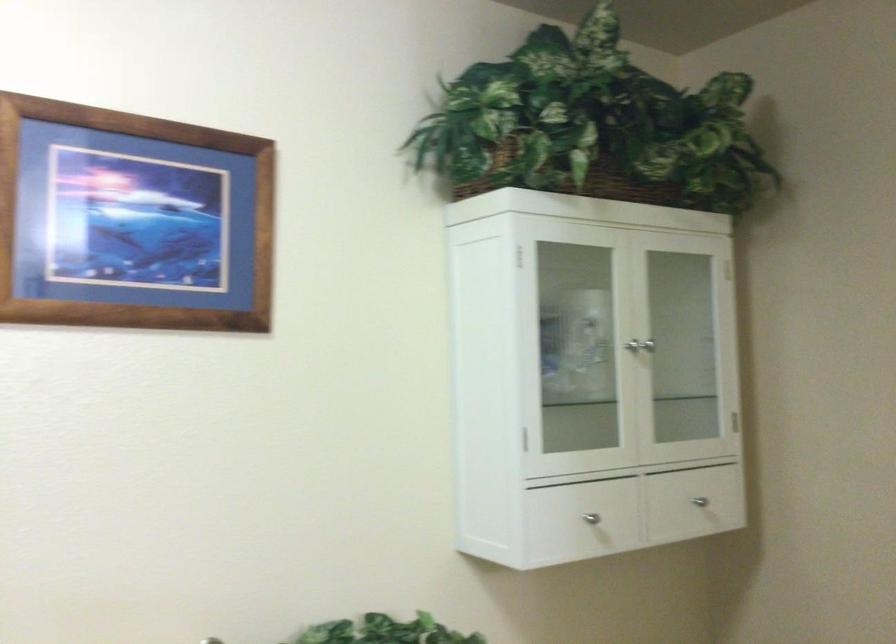
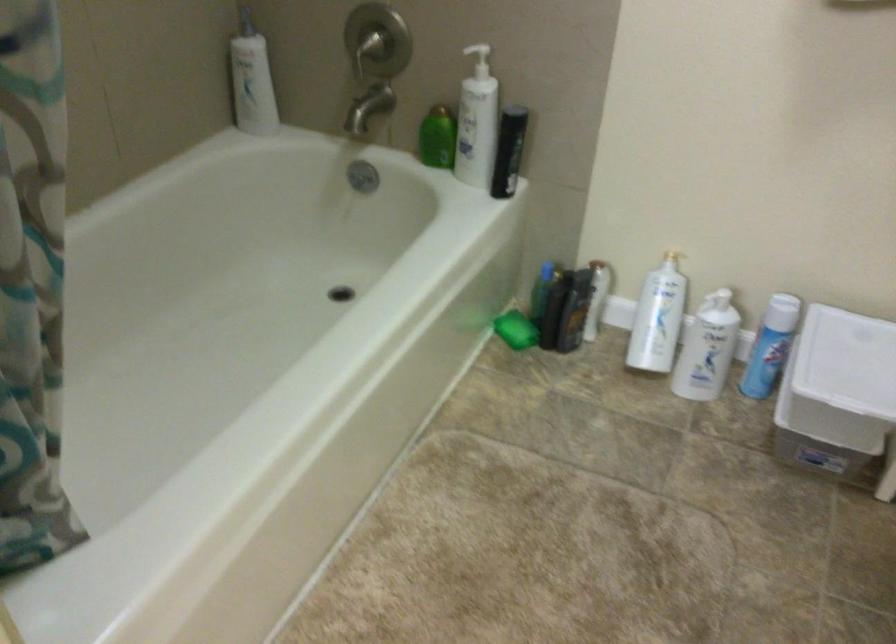
The first image is from the beginning of the video and the second image is from the end. How did the camera likely rotate when shooting the video?

The camera's rotation is toward left-down.